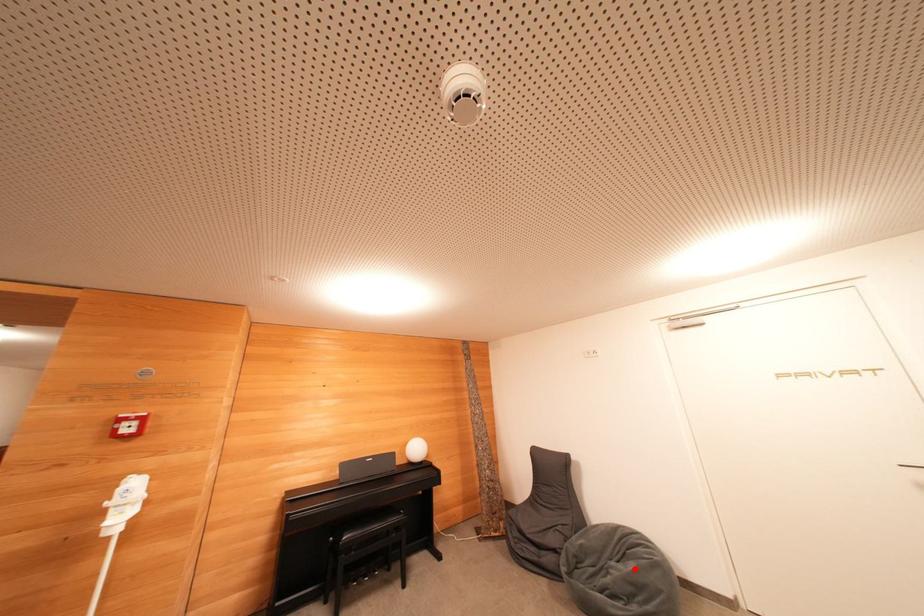
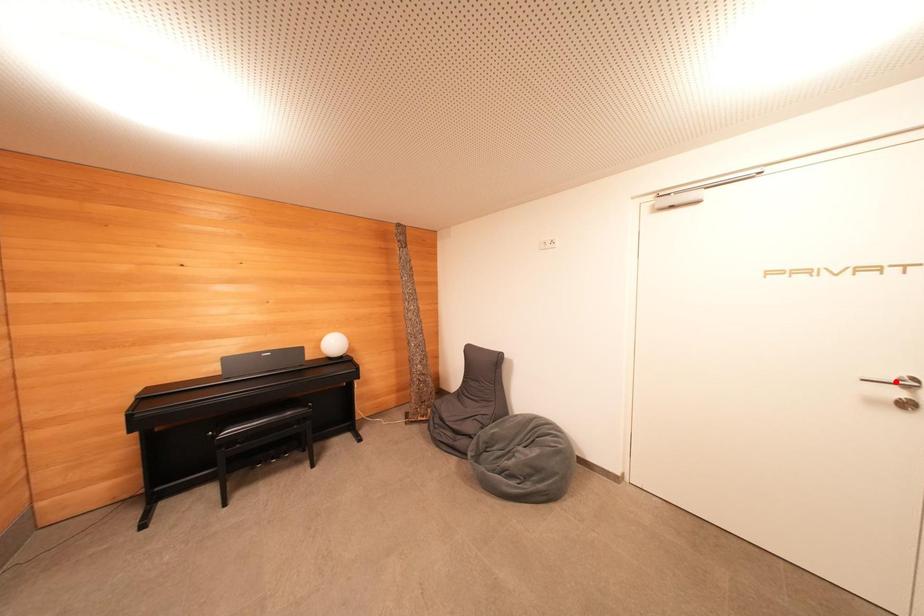
In the scene shown: I am providing you with two images of the same scene from different viewpoints. A red point is marked on the first image and another point is marked on the second image. Are the points marked in image1 and image2 representing the same 3D position?

No